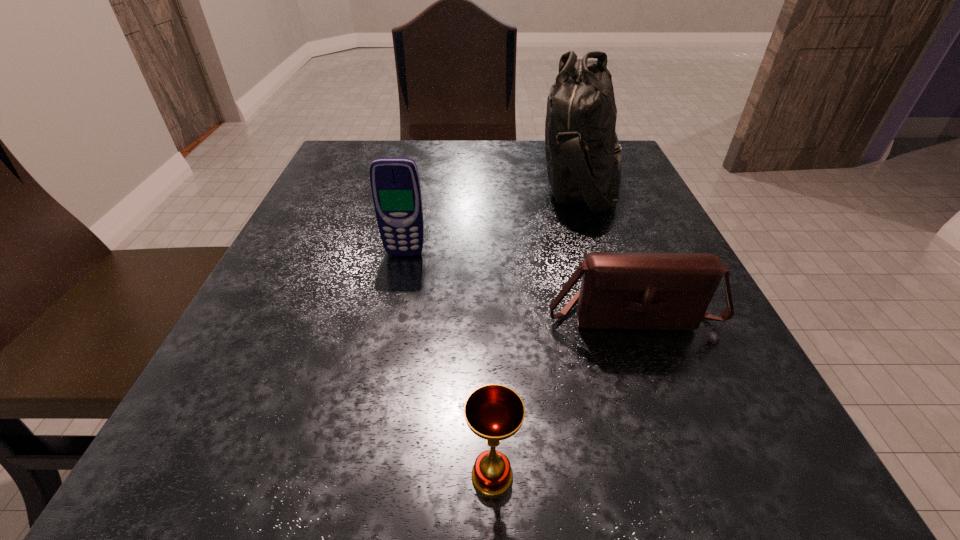
Locate an element on the screen. This screenshot has height=540, width=960. free spot between the cellular telephone and the farthest object is located at coordinates [x=494, y=217].

Identify the location of free area in between the cellular telephone and the nearer shoulder bag. The height and width of the screenshot is (540, 960). (518, 284).

I want to click on free point between the taller shoulder bag and the third shortest object, so click(x=494, y=217).

The height and width of the screenshot is (540, 960). I want to click on free point between the leftmost object and the chalice, so click(x=448, y=364).

Locate an element on the screen. This screenshot has height=540, width=960. the closest object to the taller shoulder bag is located at coordinates (643, 291).

The image size is (960, 540). In order to click on the second closest object to the shorter shoulder bag in this screenshot , I will do `click(583, 155)`.

Find the location of `vacant area that satisfies the following two spatial constraints: 1. at the front padded panel of the farther shoulder bag; 2. on the front-facing side of the second farthest object`. vacant area that satisfies the following two spatial constraints: 1. at the front padded panel of the farther shoulder bag; 2. on the front-facing side of the second farthest object is located at coordinates (611, 253).

Identify the location of blank area in the image that satisfies the following two spatial constraints: 1. at the front padded panel of the farthest object; 2. on the front flap of the nearer shoulder bag. (633, 314).

At what (x,y) coordinates should I click in order to perform the action: click on free space in the image that satisfies the following two spatial constraints: 1. on the front-facing side of the second tallest object; 2. on the right side of the second object from left to right. Please return your answer as a coordinate pair (x, y). The image size is (960, 540). Looking at the image, I should click on (358, 476).

I want to click on free space that satisfies the following two spatial constraints: 1. at the front padded panel of the farthest object; 2. on the front flap of the shorter shoulder bag, so click(633, 314).